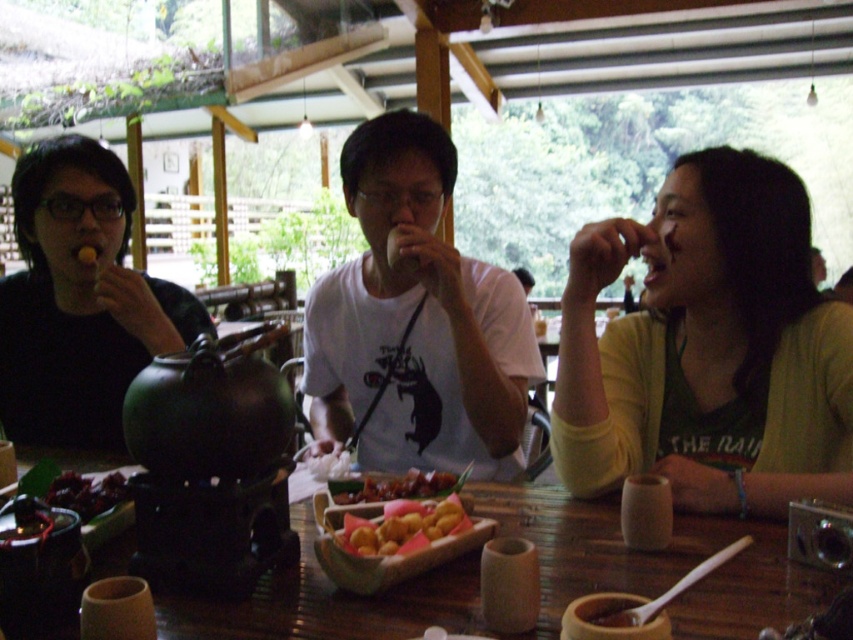
Based on the photo, between golden crispy balls at center and shiny red sauce at center, which one is positioned higher?

Positioned higher is golden crispy balls at center.

The height and width of the screenshot is (640, 853). What do you see at coordinates (404, 528) in the screenshot?
I see `golden crispy balls at center` at bounding box center [404, 528].

Is point (387, 504) farther from viewer compared to point (398, 480)?

No, (387, 504) is closer to viewer.

Find the location of a particular element. Image resolution: width=853 pixels, height=640 pixels. golden crispy balls at center is located at coordinates (404, 528).

Does yellow matte sweater at right have a greater width compared to black matte shirt at left?

No.

Who is higher up, yellow matte sweater at right or black matte shirt at left?

black matte shirt at left is higher up.

Is point (780, 262) positioned before point (25, 412)?

Yes, point (780, 262) is in front of point (25, 412).

Find the location of a particular element. This screenshot has height=640, width=853. yellow matte sweater at right is located at coordinates (709, 348).

Is point (421, 518) closer to camera compared to point (392, 545)?

No.

Who is taller, golden fried dumplings at center or golden crispy balls at center?

golden fried dumplings at center is taller.

Describe the element at coordinates (393, 540) in the screenshot. I see `golden fried dumplings at center` at that location.

Find the location of a particular element. The image size is (853, 640). golden fried dumplings at center is located at coordinates (393, 540).